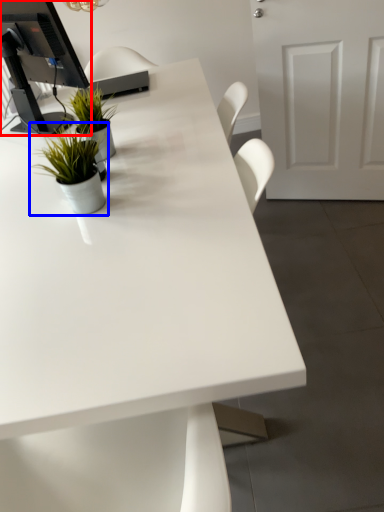
Question: Among these objects, which one is nearest to the camera, desktop computer (highlighted by a red box) or houseplant (highlighted by a blue box)?

Choices:
 (A) desktop computer
 (B) houseplant

Answer: (B)